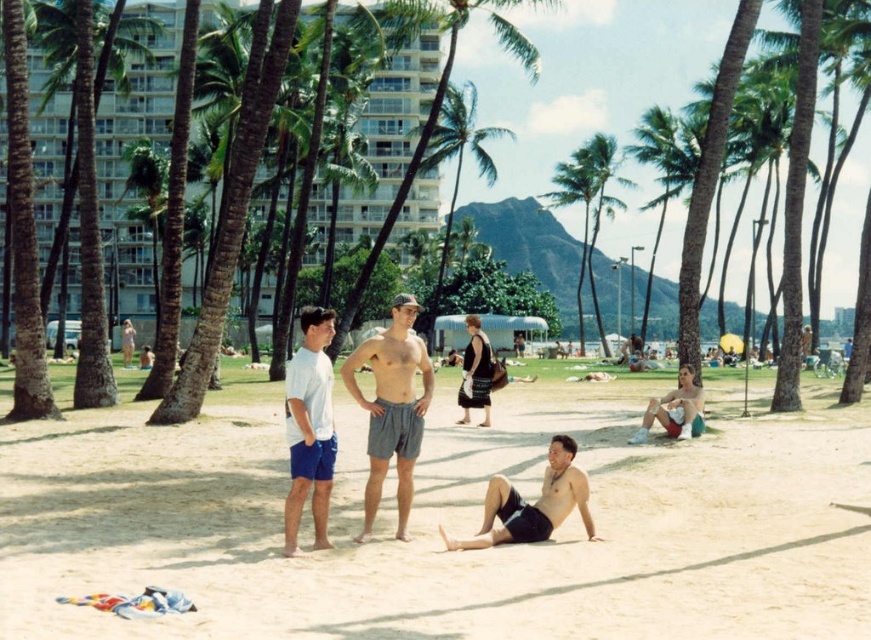
Does light brown sand at center have a greater height compared to white cotton t-shirt at center?

In fact, light brown sand at center may be shorter than white cotton t-shirt at center.

Between light brown sand at center and white cotton t-shirt at center, which one has more height?

With more height is white cotton t-shirt at center.

Does point (618, 573) lie in front of point (329, 428)?

Yes, it is.

The image size is (871, 640). I want to click on light brown sand at center, so click(446, 524).

Can you confirm if green leafy palm tree at center is positioned below beige shorts at lower right?

No.

Who is positioned more to the left, green leafy palm tree at center or beige shorts at lower right?

beige shorts at lower right

I want to click on green leafy palm tree at center, so tap(588, 209).

Is point (431, 371) positioned after point (588, 161)?

No, (431, 371) is closer to viewer.

Who is more distant from viewer, [400,449] or [603,157]?

Point [603,157]

This screenshot has height=640, width=871. Find the location of `gray cotton shorts at center`. gray cotton shorts at center is located at coordinates (392, 406).